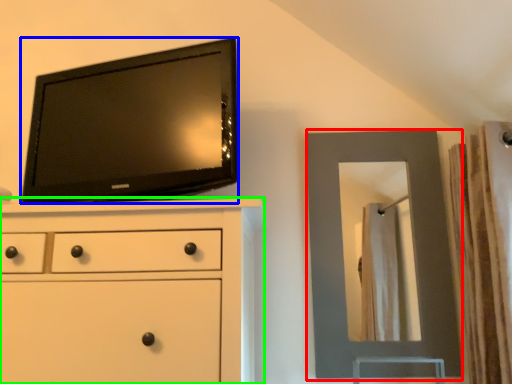
Question: Estimate the real-world distances between objects in this image. Which object is closer to mirror (highlighted by a red box), television (highlighted by a blue box) or chest of drawers (highlighted by a green box)?

Choices:
 (A) television
 (B) chest of drawers

Answer: (A)